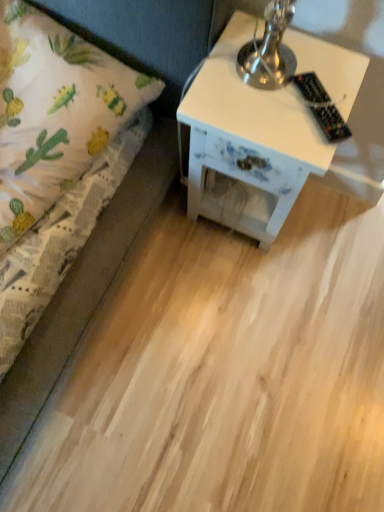
Where is `vacant space to the left of black plastic remote control at upper right`? The height and width of the screenshot is (512, 384). vacant space to the left of black plastic remote control at upper right is located at coordinates (251, 97).